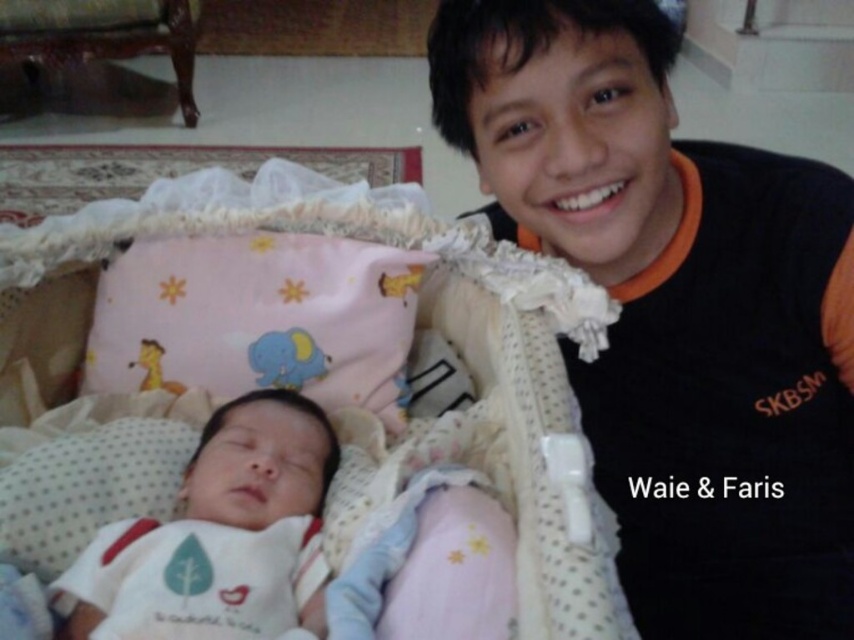
You are a photographer trying to capture a closeup shot of both the black cotton shirt at upper right and the white soft fabric at center. Given that your camera has a maximum focus range of 16 inches, will you be able to focus on both subjects simultaneously?

The black cotton shirt at upper right and white soft fabric at center are 16.78 inches apart from each other. Since the distance between them exceeds the camera maximum focus range of 16 inches, you will not be able to focus on both subjects simultaneously.

You are a parent trying to place a small stuffed animal on the pink fabric infant bed at center and the white soft fabric at center. Which surface will allow the stuffed animal to be seen more easily by someone standing at the side of the bed?

The pink fabric infant bed at center has a greater height compared to the white soft fabric at center, so placing the stuffed animal on the pink fabric infant bed at center will make it more visible to someone standing at the side of the bed.

You are a photographer setting up a shoot in this scene. You need to position a small light source so it illuminates both the black cotton shirt at upper right and the white soft fabric at center without causing harsh shadows. Given their height difference, where should you place the light source relative to the two objects?

The black cotton shirt at upper right is much taller than the white soft fabric at center. To avoid harsh shadows, the light source should be placed above and slightly behind the black cotton shirt at upper right, casting light downward toward both objects.